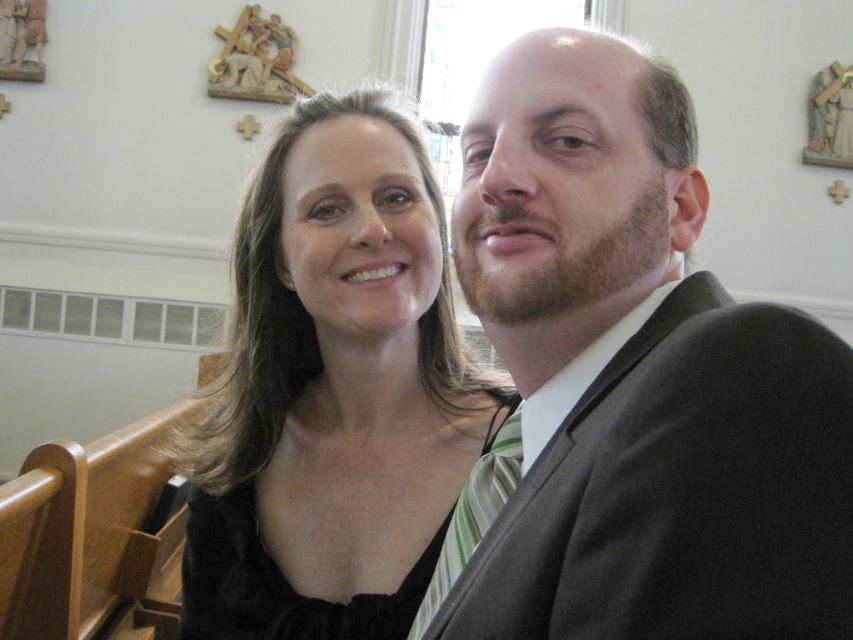
Which is behind, point (555, 344) or point (509, 464)?

Point (509, 464)

Is point (693, 188) less distant than point (468, 522)?

Yes.

Which is behind, point (605, 269) or point (469, 508)?

Positioned behind is point (469, 508).

I want to click on dark gray suit at right, so click(x=631, y=381).

The width and height of the screenshot is (853, 640). What do you see at coordinates (334, 390) in the screenshot?
I see `black satin dress at center` at bounding box center [334, 390].

At what (x,y) coordinates should I click in order to perform the action: click on black satin dress at center. Please return your answer as a coordinate pair (x, y). This screenshot has width=853, height=640. Looking at the image, I should click on (334, 390).

Is dark gray suit at right wider than black satin dress at center?

No, dark gray suit at right is not wider than black satin dress at center.

Is point (828, 556) farther from viewer compared to point (281, 353)?

No, it is not.

What are the coordinates of `dark gray suit at right` in the screenshot? It's located at (631, 381).